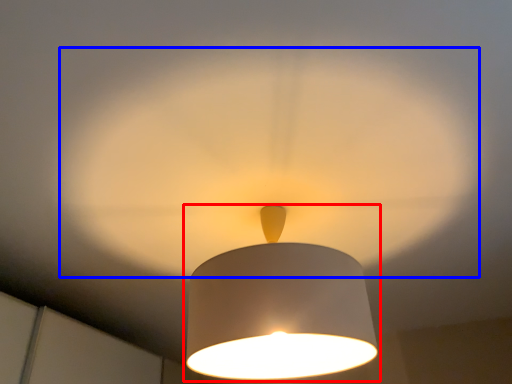
Question: Among these objects, which one is farthest to the camera, lamp (highlighted by a red box) or glow (highlighted by a blue box)?

Choices:
 (A) lamp
 (B) glow

Answer: (A)